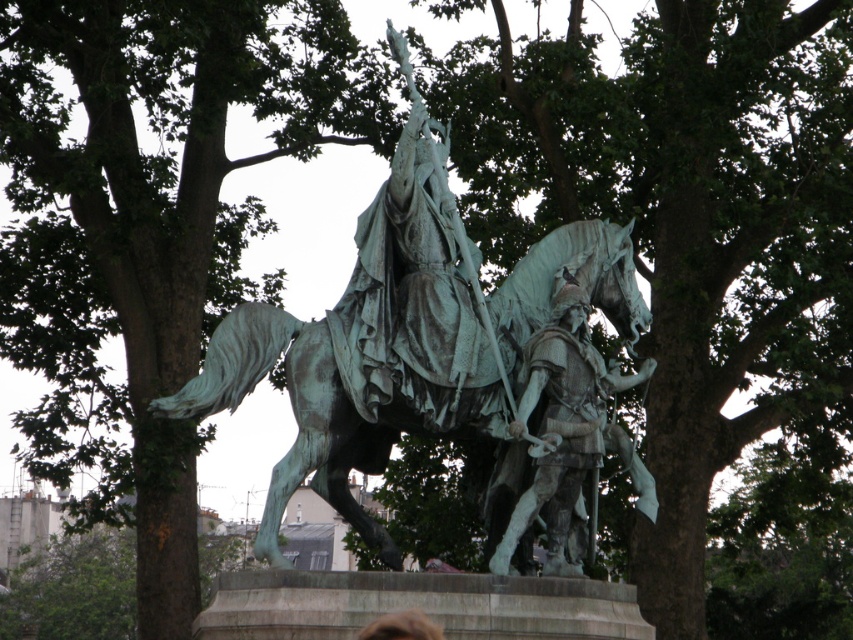
Question: Among these points, which one is farthest from the camera?

Choices:
 (A) (270, 550)
 (B) (569, 572)

Answer: (B)

Question: Where is green textured bark at upper left located in relation to bronze armor at center in the image?

Choices:
 (A) above
 (B) below

Answer: (A)

Question: Can you confirm if green patina statue at center is smaller than bronze armor at center?

Choices:
 (A) no
 (B) yes

Answer: (A)

Question: Among these objects, which one is nearest to the camera?

Choices:
 (A) bronze armor at center
 (B) green textured bark at upper left
 (C) green patina statue at center

Answer: (A)

Question: Can you confirm if green patina statue at center is positioned to the left of bronze armor at center?

Choices:
 (A) yes
 (B) no

Answer: (A)

Question: Which of the following is the closest to the observer?

Choices:
 (A) pos(408,81)
 (B) pos(48,86)

Answer: (A)